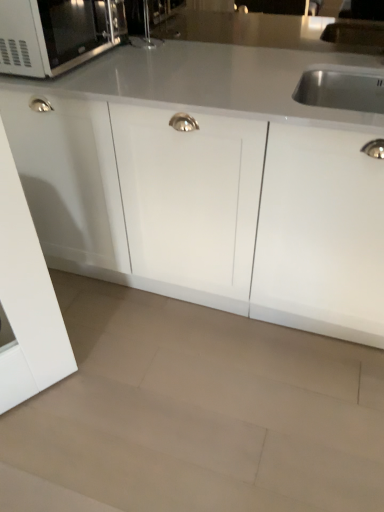
Question: Is beige polished granite at lower center taller or shorter than white glossy cabinet at center?

Choices:
 (A) tall
 (B) short

Answer: (B)

Question: From a real-world perspective, is beige polished granite at lower center positioned above or below white glossy cabinet at center?

Choices:
 (A) above
 (B) below

Answer: (B)

Question: Estimate the real-world distances between objects in this image. Which object is farther from the beige polished granite at lower center?

Choices:
 (A) white glossy cabinet at center
 (B) matte black microwave at upper left

Answer: (B)

Question: Estimate the real-world distances between objects in this image. Which object is closer to the beige polished granite at lower center?

Choices:
 (A) white glossy cabinet at center
 (B) matte black microwave at upper left

Answer: (A)